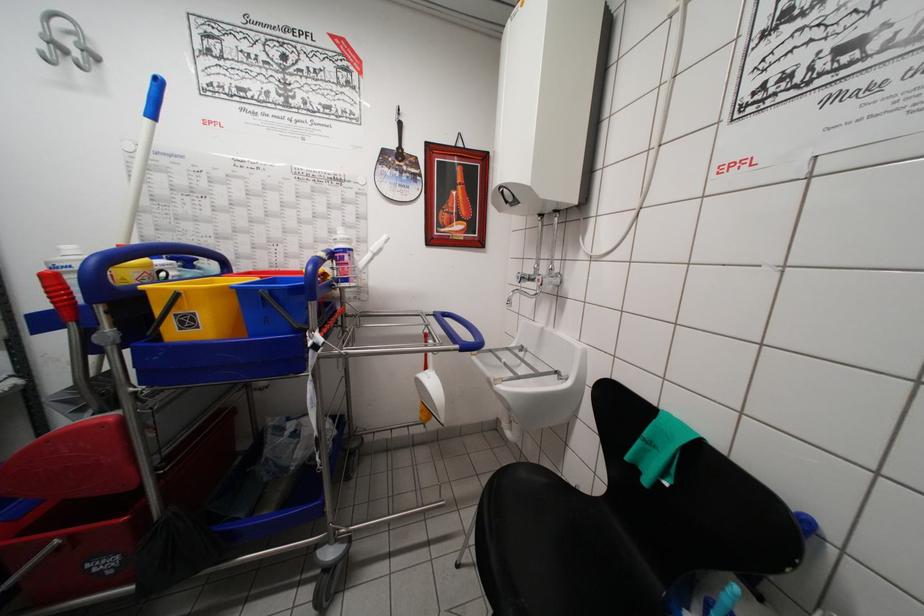
Where is `white dustpan handle`? This screenshot has height=616, width=924. white dustpan handle is located at coordinates (372, 252).